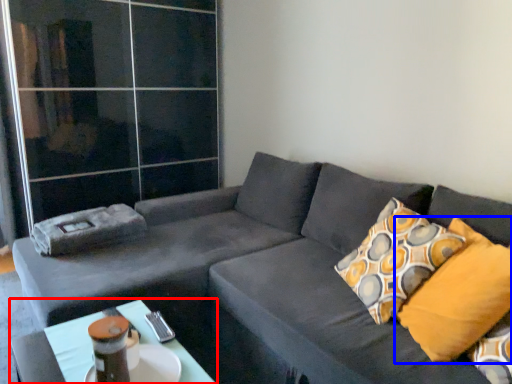
Question: Among these objects, which one is farthest to the camera, table (highlighted by a red box) or pillow (highlighted by a blue box)?

Choices:
 (A) table
 (B) pillow

Answer: (B)